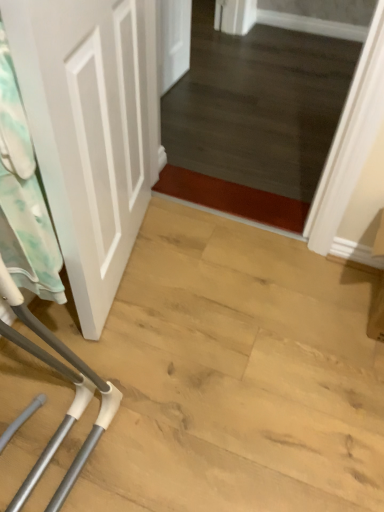
Question: Considering their positions, is white matte door at left located in front of or behind white fabric laundry at left?

Choices:
 (A) behind
 (B) front

Answer: (B)

Question: Is white matte door at left taller or shorter than white fabric laundry at left?

Choices:
 (A) short
 (B) tall

Answer: (B)

Question: In the image, is white matte door at left on the left side or the right side of white fabric laundry at left?

Choices:
 (A) left
 (B) right

Answer: (B)

Question: Looking at their shapes, would you say white fabric laundry at left is wider or thinner than white matte door at left?

Choices:
 (A) wide
 (B) thin

Answer: (B)

Question: Relative to white matte door at left, is white fabric laundry at left in front or behind?

Choices:
 (A) front
 (B) behind

Answer: (B)

Question: In terms of height, does white fabric laundry at left look taller or shorter compared to white matte door at left?

Choices:
 (A) short
 (B) tall

Answer: (A)

Question: Is white fabric laundry at left situated inside white matte door at left or outside?

Choices:
 (A) outside
 (B) inside

Answer: (B)